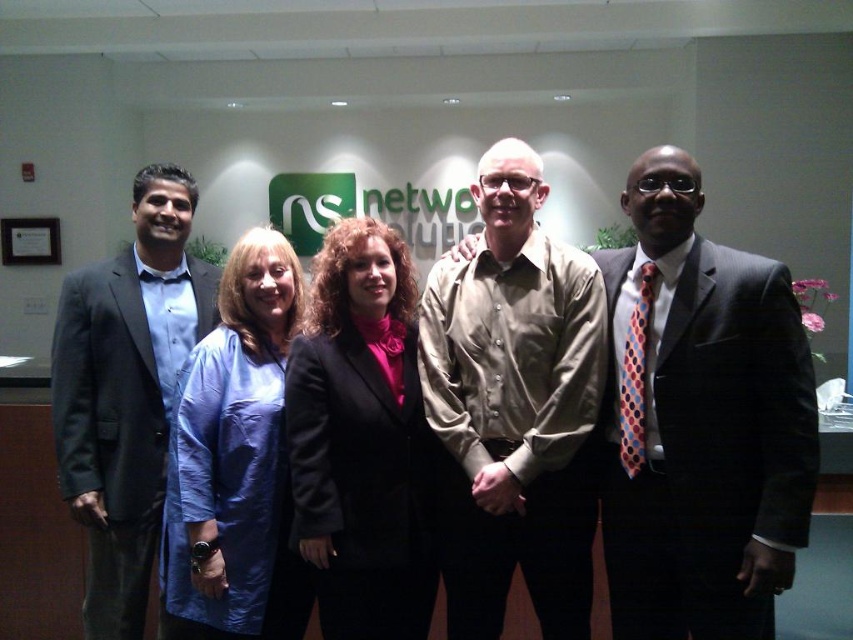
You are standing in the room and see the point marked at coordinates (126,392). What object is located at that point?

The point at coordinates (126,392) marks the location of the matte blue suit at left.

You are a photographer adjusting the camera settings to ensure all subjects are in focus. The tan cotton shirt at center and matte black blazer at center are both in your frame. Considering their widths, which one might require more careful adjustment to avoid blurring due to its size?

The tan cotton shirt at center has a greater width than the matte black blazer at center, so it might require more careful adjustment to avoid blurring due to its larger size.